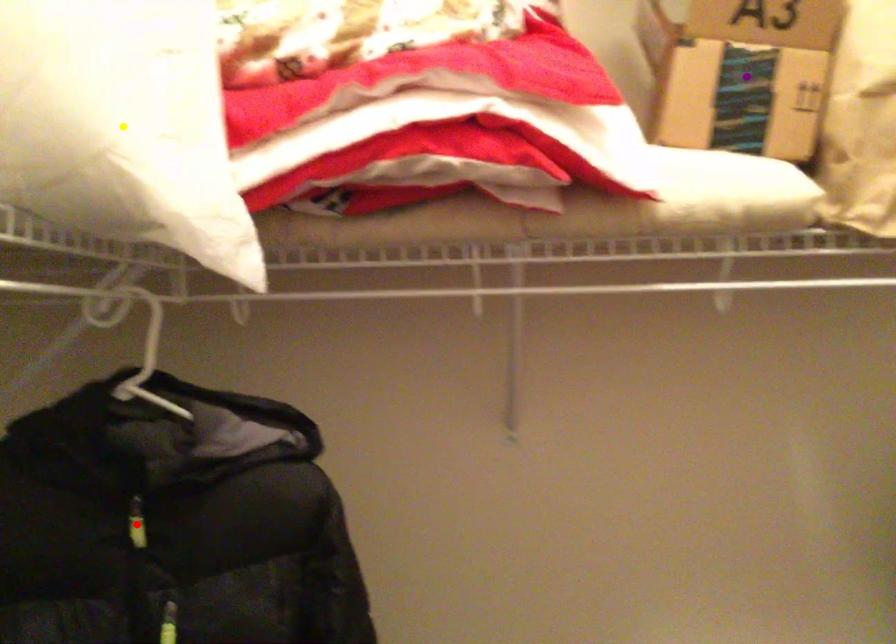
Looking at this image, order these from nearest to farthest:
red point
yellow point
purple point

purple point → red point → yellow point